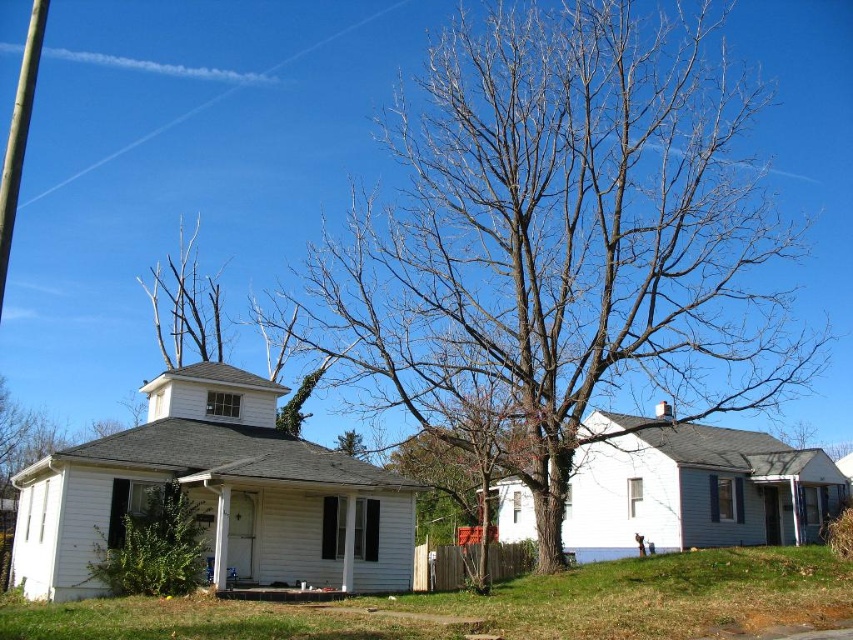
Does brown/dry bark tree at center have a greater height compared to bare branches at upper center?

Indeed, brown/dry bark tree at center has a greater height compared to bare branches at upper center.

From the picture: Which is more to the right, brown/dry bark tree at center or bare branches at upper center?

brown/dry bark tree at center

Is point (721, 298) positioned before point (210, 358)?

Yes, point (721, 298) is closer to viewer.

Identify the location of brown/dry bark tree at center. (563, 237).

Who is higher up, white wood house at center or bare branches at upper center?

bare branches at upper center is higher up.

Is white wood house at center smaller than bare branches at upper center?

Yes, white wood house at center is smaller than bare branches at upper center.

Is point (268, 460) more distant than point (189, 280)?

That is False.

The image size is (853, 640). What are the coordinates of `white wood house at center` in the screenshot? It's located at (216, 493).

Locate an element on the screen. The image size is (853, 640). white matte house at center is located at coordinates (695, 492).

Based on the photo, between white matte house at center and bare branches at upper center, which one has less height?

white matte house at center is shorter.

Is point (595, 540) positioned before point (158, 326)?

Yes, point (595, 540) is in front of point (158, 326).

Where is `white matte house at center`? This screenshot has height=640, width=853. white matte house at center is located at coordinates (695, 492).